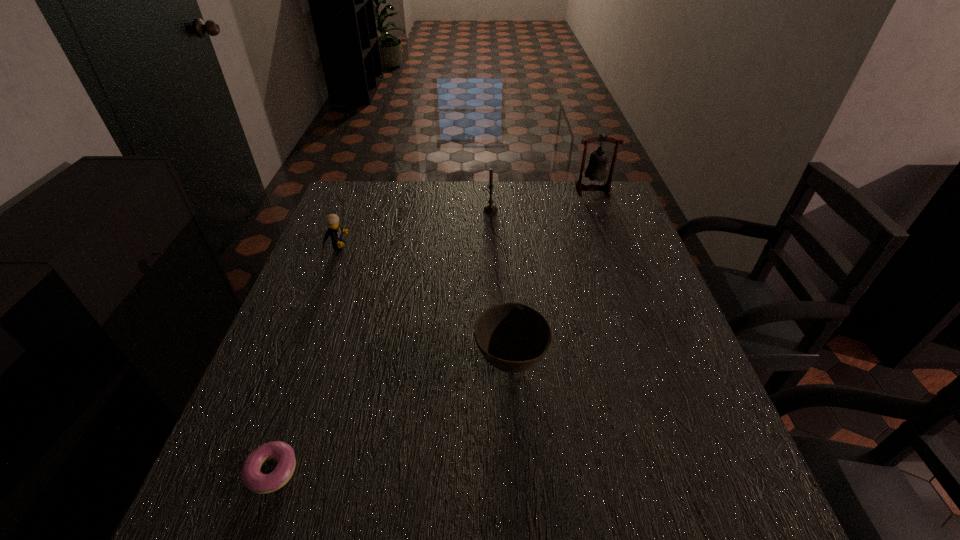
At what (x,y) coordinates should I click in order to perform the action: click on the farthest object. Please return your answer as a coordinate pair (x, y). The width and height of the screenshot is (960, 540). Looking at the image, I should click on (596, 170).

The height and width of the screenshot is (540, 960). What are the coordinates of `the rightmost object` in the screenshot? It's located at (596, 170).

You are a GUI agent. You are given a task and a screenshot of the screen. Output one action in this format:
    pyautogui.click(x=<x>, y=<y>)
    Task: Click on the candle
    
    Given the screenshot: What is the action you would take?
    pyautogui.click(x=490, y=208)

This screenshot has width=960, height=540. I want to click on the second farthest object, so click(x=490, y=208).

The height and width of the screenshot is (540, 960). Find the location of `the third nearest object`. the third nearest object is located at coordinates 334,231.

Where is `the fourth farthest object`? The image size is (960, 540). the fourth farthest object is located at coordinates (513, 337).

The image size is (960, 540). In order to click on the nearest object in this screenshot , I will do `click(257, 482)`.

I want to click on doughnut, so click(257, 482).

What are the coordinates of `free space located on the front of the farthest object` in the screenshot? It's located at (603, 217).

Identify the location of vacant region located on the right of the fourth shortest object. (623, 210).